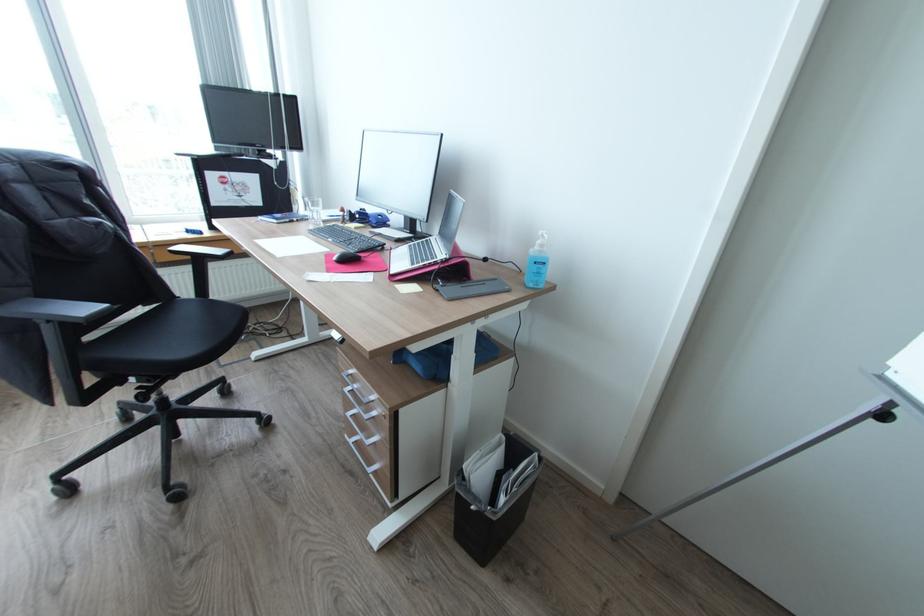
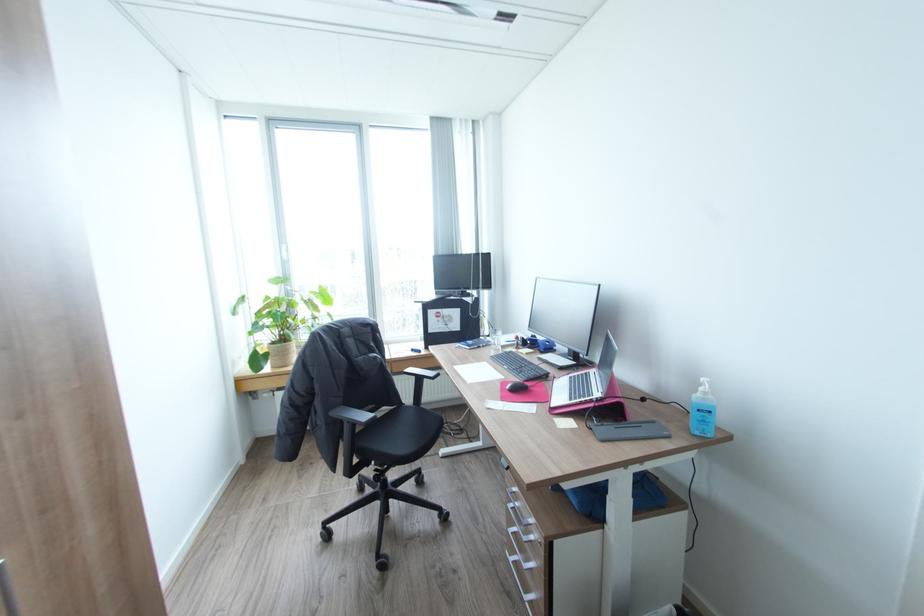
In the second image, find the point that corresponds to the point at 455,300 in the first image.

(608, 440)